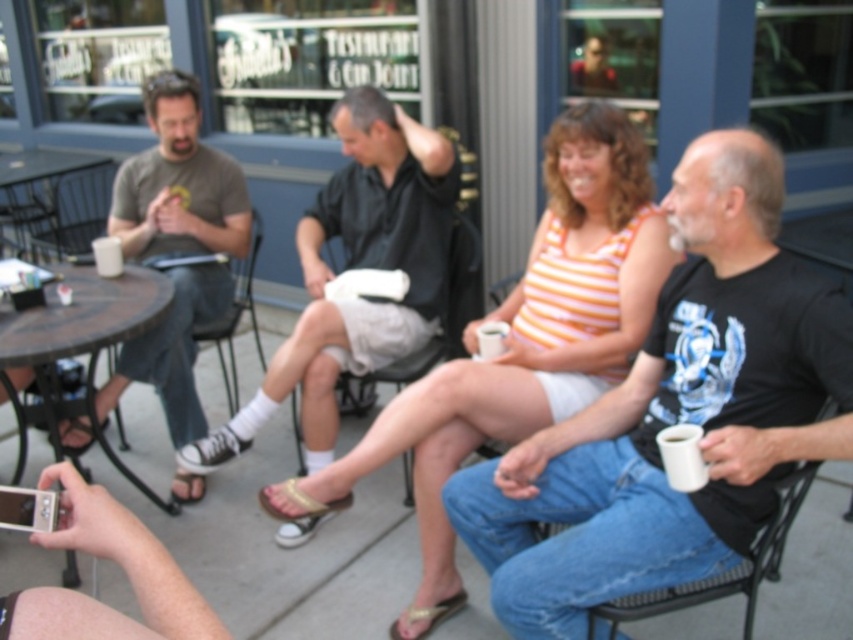
Question: Can you confirm if orange striped tank top at center is positioned above black metal table at left?

Choices:
 (A) no
 (B) yes

Answer: (A)

Question: Which object is positioned farthest from the beige fabric sandal at lower center?

Choices:
 (A) black canvas shoe at center
 (B) wooden table at lower left
 (C) black metal table at left
 (D) brown leather sandal at lower left

Answer: (C)

Question: From the image, what is the correct spatial relationship of black matte t-shirt at center in relation to orange striped tank top at center?

Choices:
 (A) below
 (B) above

Answer: (A)

Question: Is black matte t-shirt at center wider than wooden table at lower left?

Choices:
 (A) yes
 (B) no

Answer: (A)

Question: Which of the following is the closest to the observer?

Choices:
 (A) brown leather sandal at lower left
 (B) black canvas shoe at center

Answer: (B)

Question: Which of the following is the farthest from the observer?

Choices:
 (A) (263, 499)
 (B) (433, 356)

Answer: (B)